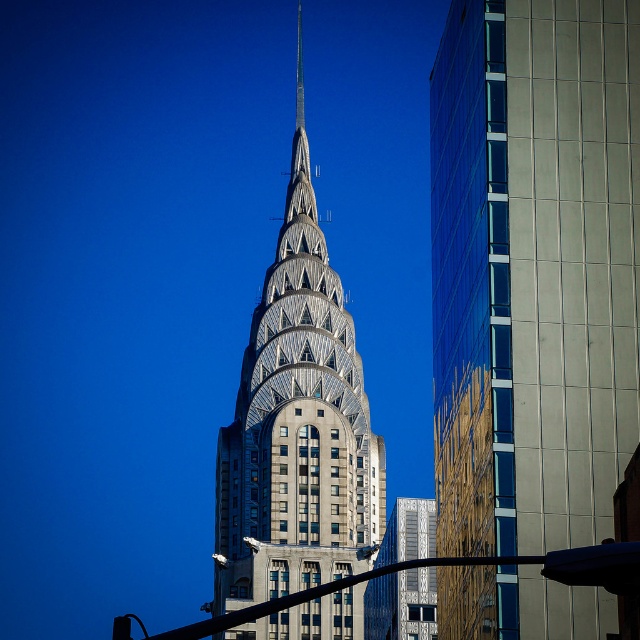
From the picture: Is silver metallic spire at center taller than shiny silver spire at center?

Correct, silver metallic spire at center is much taller as shiny silver spire at center.

How distant is silver metallic spire at center from shiny silver spire at center?

A distance of 29.08 meters exists between silver metallic spire at center and shiny silver spire at center.

At what (x,y) coordinates should I click in order to perform the action: click on silver metallic spire at center. Please return your answer as a coordinate pair (x, y). Looking at the image, I should click on (296, 429).

Between reflective glass skyscraper at center and shiny silver spire at center, which one appears on the right side from the viewer's perspective?

reflective glass skyscraper at center

Describe the element at coordinates (532, 269) in the screenshot. The height and width of the screenshot is (640, 640). I see `reflective glass skyscraper at center` at that location.

The height and width of the screenshot is (640, 640). I want to click on reflective glass skyscraper at center, so click(532, 269).

Does reflective glass skyscraper at center have a greater width compared to silver metallic spire at center?

No.

Who is more distant from viewer, (548, 589) or (326, 396)?

The point (326, 396) is behind.

Who is more forward, (x=618, y=356) or (x=272, y=483)?

Point (x=618, y=356)

What are the coordinates of `reflective glass skyscraper at center` in the screenshot? It's located at (532, 269).